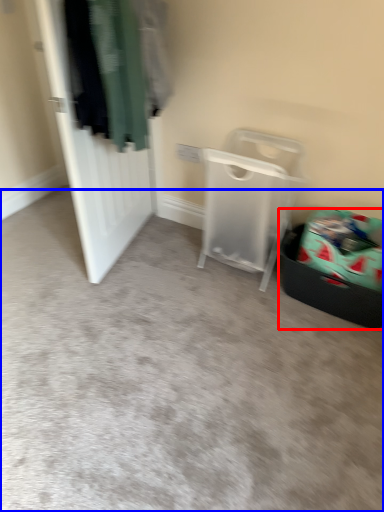
Question: Which of the following is the farthest to the observer, laundry basket (highlighted by a red box) or plain (highlighted by a blue box)?

Choices:
 (A) laundry basket
 (B) plain

Answer: (A)